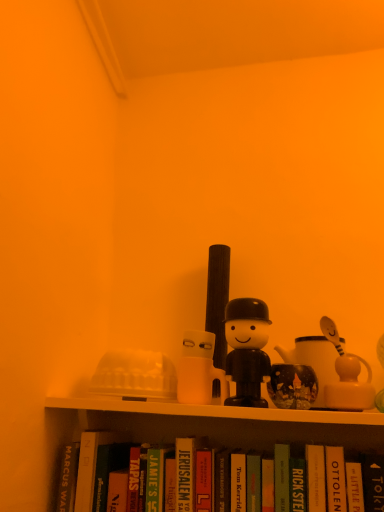
Image resolution: width=384 pixels, height=512 pixels. I want to click on hardcover book at center, the 7th paperback book positioned from the left, so click(373, 482).

Measure the distance between hardcover book at center, placed as the 1th paperback book when sorted from right to left, and camera.

The depth of hardcover book at center, placed as the 1th paperback book when sorted from right to left, is 29.80 inches.

The image size is (384, 512). I want to click on white glossy teapot at right, the 4th toy when ordered from left to right, so click(x=346, y=376).

Describe the element at coordinates (205, 480) in the screenshot. I see `hardcover book at center, which appears as the 2th paperback book when viewed from the left` at that location.

What is the approximate width of hardcover book at lower right, which appears as the sixth paperback book when viewed from the left?

hardcover book at lower right, which appears as the sixth paperback book when viewed from the left, is 3.83 inches wide.

What do you see at coordinates (156, 478) in the screenshot?
I see `green matte book at lower center, marked as the 7th paperback book in a right-to-left arrangement` at bounding box center [156, 478].

The width and height of the screenshot is (384, 512). I want to click on green matte book at lower center, the first paperback book from the left, so 156,478.

Where is `hardcover book at center, placed as the 1th paperback book when sorted from right to left`? hardcover book at center, placed as the 1th paperback book when sorted from right to left is located at coordinates (373, 482).

Is hardcover book at center, placed as the third paperback book when sorted from left to right, directly adjacent to green matte book at lower center, the first paperback book from the left?

hardcover book at center, placed as the third paperback book when sorted from left to right, is not next to green matte book at lower center, the first paperback book from the left, and they're not touching.

From the green matte book at lower center, marked as the 7th paperback book in a right-to-left arrangement, count 2nd paperback book to the right and point to it. Please provide its 2D coordinates.

[(222, 481)]

Between point (217, 454) and point (160, 494), which one is positioned in front?

The point (160, 494) is more forward.

From a real-world perspective, which object rests below the other?

hardcover book at center, acting as the fifth paperback book starting from the right, is physically lower.

Is point (289, 454) less distant than point (167, 448)?

Yes, point (289, 454) is in front of point (167, 448).

Is there a large distance between green matte paperback book at center, placed as the fourth paperback book when sorted from left to right, and green matte book at lower center, the first paperback book from the left?

green matte paperback book at center, placed as the fourth paperback book when sorted from left to right, is near green matte book at lower center, the first paperback book from the left, not far away.

Is green matte paperback book at center, placed as the fourth paperback book when sorted from left to right, facing away from green matte book at lower center, the first paperback book from the left?

green matte paperback book at center, placed as the fourth paperback book when sorted from left to right, does not have its back to green matte book at lower center, the first paperback book from the left.

From a real-world perspective, is green matte paperback book at center, which is the fourth paperback book in right-to-left order, above or below green matte book at lower center, the first paperback book from the left?

green matte paperback book at center, which is the fourth paperback book in right-to-left order, is situated higher than green matte book at lower center, the first paperback book from the left, in the real world.

Is hardcover book at center, placed as the third paperback book when sorted from left to right, outside of hardcover book at center, placed as the 1th paperback book when sorted from right to left?

hardcover book at center, placed as the third paperback book when sorted from left to right, is positioned outside hardcover book at center, placed as the 1th paperback book when sorted from right to left.

Looking at this image, is hardcover book at center, acting as the fifth paperback book starting from the right, thinner than hardcover book at center, placed as the 1th paperback book when sorted from right to left?

Yes, hardcover book at center, acting as the fifth paperback book starting from the right, is thinner than hardcover book at center, placed as the 1th paperback book when sorted from right to left.

Between hardcover book at center, placed as the third paperback book when sorted from left to right, and hardcover book at center, the 7th paperback book positioned from the left, which one has more height?

Standing taller between the two is hardcover book at center, the 7th paperback book positioned from the left.

Considering the sizes of objects hardcover book at center, placed as the third paperback book when sorted from left to right, and hardcover book at center, placed as the 1th paperback book when sorted from right to left, in the image provided, who is smaller, hardcover book at center, placed as the third paperback book when sorted from left to right, or hardcover book at center, placed as the 1th paperback book when sorted from right to left,?

hardcover book at center, placed as the third paperback book when sorted from left to right, is smaller.

Between white glossy teapot at right, the 4th toy when ordered from left to right, and green matte book at lower center, marked as the 7th paperback book in a right-to-left arrangement, which one has larger width?

Wider between the two is green matte book at lower center, marked as the 7th paperback book in a right-to-left arrangement.

Can you confirm if white glossy teapot at right, which is counted as the 1th toy, starting from the right, is bigger than green matte book at lower center, the first paperback book from the left?

Incorrect, white glossy teapot at right, which is counted as the 1th toy, starting from the right, is not larger than green matte book at lower center, the first paperback book from the left.

Could you tell me if white glossy teapot at right, which is counted as the 1th toy, starting from the right, is turned towards green matte book at lower center, the first paperback book from the left?

No, white glossy teapot at right, which is counted as the 1th toy, starting from the right, is not turned towards green matte book at lower center, the first paperback book from the left.

From a real-world perspective, is hardcover book at center, which appears as the 2th paperback book when viewed from the left, above or below white matte mug at center, the fourth toy in the right-to-left sequence?

In terms of real-world spatial position, hardcover book at center, which appears as the 2th paperback book when viewed from the left, is below white matte mug at center, the fourth toy in the right-to-left sequence.

Is hardcover book at center, which appears as the 2th paperback book when viewed from the left, not close to white matte mug at center, arranged as the 1th toy when viewed from the left?

hardcover book at center, which appears as the 2th paperback book when viewed from the left, is actually quite close to white matte mug at center, arranged as the 1th toy when viewed from the left.

Between hardcover book at center, arranged as the sixth paperback book when viewed from the right, and white matte mug at center, arranged as the 1th toy when viewed from the left, which one appears on the right side from the viewer's perspective?

From the viewer's perspective, hardcover book at center, arranged as the sixth paperback book when viewed from the right, appears more on the right side.

Looking at this image, which of these two, hardcover book at center, which appears as the 2th paperback book when viewed from the left, or white matte mug at center, arranged as the 1th toy when viewed from the left, is thinner?

Thinner between the two is white matte mug at center, arranged as the 1th toy when viewed from the left.

Considering the relative sizes of white matte mug at center, arranged as the 1th toy when viewed from the left, and white glossy teapot at right, which is counted as the 1th toy, starting from the right, in the image provided, is white matte mug at center, arranged as the 1th toy when viewed from the left, smaller than white glossy teapot at right, which is counted as the 1th toy, starting from the right,?

Actually, white matte mug at center, arranged as the 1th toy when viewed from the left, might be larger than white glossy teapot at right, which is counted as the 1th toy, starting from the right.

From a real-world perspective, relative to white glossy teapot at right, which is counted as the 1th toy, starting from the right, is white matte mug at center, the fourth toy in the right-to-left sequence, vertically above or below?

white matte mug at center, the fourth toy in the right-to-left sequence, is above white glossy teapot at right, which is counted as the 1th toy, starting from the right.

Considering the relative sizes of white matte mug at center, the fourth toy in the right-to-left sequence, and white glossy teapot at right, which is counted as the 1th toy, starting from the right, in the image provided, is white matte mug at center, the fourth toy in the right-to-left sequence, shorter than white glossy teapot at right, which is counted as the 1th toy, starting from the right,?

Incorrect, the height of white matte mug at center, the fourth toy in the right-to-left sequence, does not fall short of that of white glossy teapot at right, which is counted as the 1th toy, starting from the right.

Is white matte mug at center, arranged as the 1th toy when viewed from the left, oriented away from white glossy teapot at right, the 4th toy when ordered from left to right?

No, white matte mug at center, arranged as the 1th toy when viewed from the left, is not facing the opposite direction of white glossy teapot at right, the 4th toy when ordered from left to right.

Based on their sizes in the image, would you say black plastic toy at center, which is the second toy from left to right, is bigger or smaller than green matte paperback book at center, which is the fourth paperback book in right-to-left order?

Clearly, black plastic toy at center, which is the second toy from left to right, is larger in size than green matte paperback book at center, which is the fourth paperback book in right-to-left order.

Can you confirm if black plastic toy at center, arranged as the 3th toy when viewed from the right, is positioned to the left of green matte paperback book at center, which is the fourth paperback book in right-to-left order?

Indeed, black plastic toy at center, arranged as the 3th toy when viewed from the right, is positioned on the left side of green matte paperback book at center, which is the fourth paperback book in right-to-left order.

Based on the photo, from a real-world perspective, is black plastic toy at center, arranged as the 3th toy when viewed from the right, positioned above or below green matte paperback book at center, which is the fourth paperback book in right-to-left order?

Clearly, from a real-world perspective, black plastic toy at center, arranged as the 3th toy when viewed from the right, is above green matte paperback book at center, which is the fourth paperback book in right-to-left order.

Does black plastic toy at center, arranged as the 3th toy when viewed from the right, contain green matte paperback book at center, placed as the fourth paperback book when sorted from left to right?

No, black plastic toy at center, arranged as the 3th toy when viewed from the right, does not contain green matte paperback book at center, placed as the fourth paperback book when sorted from left to right.

From a real-world perspective, count 2nd paperback books downward from the green matte book at lower center, the first paperback book from the left, and point to it. Please provide its 2D coordinates.

[(222, 481)]

Which paperback book is the 3rd one when counting from the left side of the green matte paperback book at center, which is the fourth paperback book in right-to-left order? Please provide its 2D coordinates.

[(156, 478)]

Considering their positions, is hardcover book at lower right, which appears as the sixth paperback book when viewed from the left, positioned closer to black plastic toy at center, which is the second toy from left to right, than white matte mug at center, the fourth toy in the right-to-left sequence?

Based on the image, white matte mug at center, the fourth toy in the right-to-left sequence, appears to be nearer to black plastic toy at center, which is the second toy from left to right.

Which object lies further to the anchor point hardcover book at center, the 7th paperback book positioned from the left, hardcover book at lower right, which is the second paperback book in right-to-left order, or hardcover book at center, acting as the fifth paperback book starting from the right?

hardcover book at center, acting as the fifth paperback book starting from the right, is further to hardcover book at center, the 7th paperback book positioned from the left.

In the scene shown: Based on their spatial positions, is green matte paperback book at center, which is the fourth paperback book in right-to-left order, or green matte book at lower center, marked as the 7th paperback book in a right-to-left arrangement, closer to hardcover book at center, placed as the third paperback book when sorted from left to right?

Based on the image, green matte paperback book at center, which is the fourth paperback book in right-to-left order, appears to be nearer to hardcover book at center, placed as the third paperback book when sorted from left to right.

Estimate the real-world distances between objects in this image. Which object is further from white matte mug at center, arranged as the 1th toy when viewed from the left, hardcover book at center, arranged as the sixth paperback book when viewed from the right, or hardcover book at lower right, which appears as the sixth paperback book when viewed from the left?

Among the two, hardcover book at lower right, which appears as the sixth paperback book when viewed from the left, is located further to white matte mug at center, arranged as the 1th toy when viewed from the left.

Based on their spatial positions, is hardcover book at center, which appears as the 2th paperback book when viewed from the left, or hardcover book at center, the 5th paperback book viewed from the left, further from green matte book at lower center, marked as the 7th paperback book in a right-to-left arrangement?

hardcover book at center, the 5th paperback book viewed from the left, is positioned further to the anchor green matte book at lower center, marked as the 7th paperback book in a right-to-left arrangement.

Which object lies nearer to the anchor point green matte paperback book at center, placed as the fourth paperback book when sorted from left to right, hardcover book at center, the 5th paperback book viewed from the left, or translucent glass mug at center, which ranks as the 2th toy in right-to-left order?

Based on the image, hardcover book at center, the 5th paperback book viewed from the left, appears to be nearer to green matte paperback book at center, placed as the fourth paperback book when sorted from left to right.

Based on their spatial positions, is hardcover book at center, placed as the third paperback book when sorted from left to right, or hardcover book at center, the 5th paperback book viewed from the left, further from green matte paperback book at center, placed as the fourth paperback book when sorted from left to right?

hardcover book at center, placed as the third paperback book when sorted from left to right.

When comparing their distances from hardcover book at center, which appears as the 2th paperback book when viewed from the left, does white matte mug at center, the fourth toy in the right-to-left sequence, or green matte paperback book at center, which is the fourth paperback book in right-to-left order, seem closer?

The object closer to hardcover book at center, which appears as the 2th paperback book when viewed from the left, is green matte paperback book at center, which is the fourth paperback book in right-to-left order.

Find the location of `toy that lies between white glossy teapot at right, the 4th toy when ordered from left to right, and hardcover book at center, which appears as the 2th paperback book when viewed from the left, from top to bottom`. toy that lies between white glossy teapot at right, the 4th toy when ordered from left to right, and hardcover book at center, which appears as the 2th paperback book when viewed from the left, from top to bottom is located at coordinates (292, 386).

What are the coordinates of `toy that lies between white glossy teapot at right, the 4th toy when ordered from left to right, and hardcover book at center, the 5th paperback book viewed from the left, from top to bottom` in the screenshot? It's located at (292, 386).

The image size is (384, 512). Find the location of `paperback book between translucent glass mug at center, placed as the third toy when sorted from left to right, and hardcover book at lower right, which appears as the sixth paperback book when viewed from the left, in the up-down direction`. paperback book between translucent glass mug at center, placed as the third toy when sorted from left to right, and hardcover book at lower right, which appears as the sixth paperback book when viewed from the left, in the up-down direction is located at coordinates (281, 477).

Where is `paperback book situated between green matte paperback book at center, placed as the fourth paperback book when sorted from left to right, and hardcover book at lower right, which appears as the sixth paperback book when viewed from the left, from left to right`? Image resolution: width=384 pixels, height=512 pixels. paperback book situated between green matte paperback book at center, placed as the fourth paperback book when sorted from left to right, and hardcover book at lower right, which appears as the sixth paperback book when viewed from the left, from left to right is located at coordinates (297, 484).